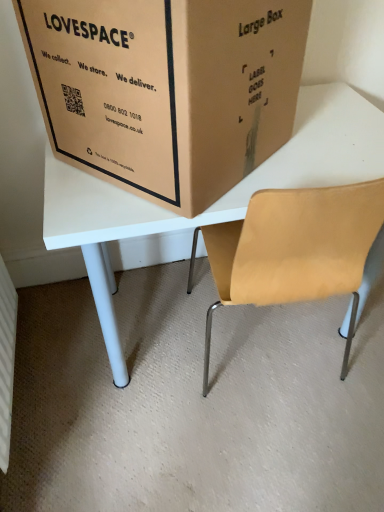
Identify the location of free space underneath matte white table at center (from a real-world perspective). This screenshot has width=384, height=512. tap(256, 351).